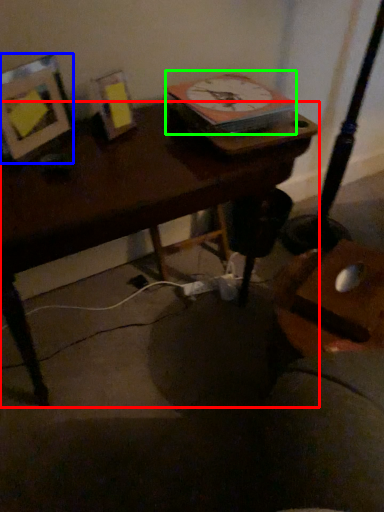
Question: Considering the real-world distances, which object is farthest from desk (highlighted by a red box)? picture frame (highlighted by a blue box) or clock (highlighted by a green box)?

Choices:
 (A) picture frame
 (B) clock

Answer: (B)